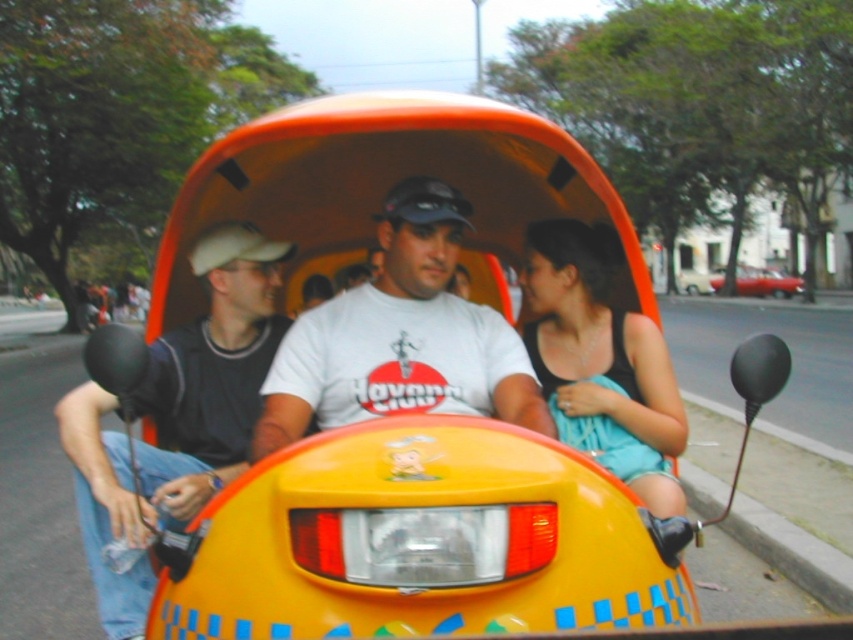
Question: Estimate the real-world distances between objects in this image. Which object is farther from the shiny red car at center?

Choices:
 (A) white matte t-shirt at center
 (B) matte black shirt at left
 (C) black matte tank top at center

Answer: (B)

Question: Which object appears closest to the camera in this image?

Choices:
 (A) matte black shirt at left
 (B) black matte tank top at center
 (C) shiny red car at center

Answer: (A)

Question: Is black matte tank top at center below shiny red car at center?

Choices:
 (A) yes
 (B) no

Answer: (A)

Question: Can you confirm if white matte t-shirt at center is wider than shiny red car at center?

Choices:
 (A) yes
 (B) no

Answer: (B)

Question: Considering the real-world distances, which object is farthest from the matte black shirt at left?

Choices:
 (A) shiny red car at center
 (B) white matte t-shirt at center

Answer: (A)

Question: Can you confirm if black matte tank top at center is bigger than shiny red car at center?

Choices:
 (A) no
 (B) yes

Answer: (A)